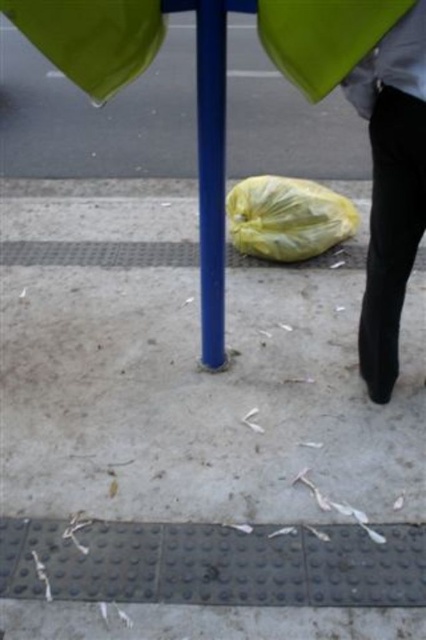
You are a visually impaired pedestrian using a white cane. You feel a yellow matte plastic bag at center and a blue glossy pole at center. Which object is closer to you?

The yellow matte plastic bag at center is closer to the viewer than the blue glossy pole at center.

You are a visually impaired pedestrian using a white cane. You feel a blue glossy pole at center and a yellow plastic bag at lower center on the sidewalk. Which object is narrower when touched?

The blue glossy pole at center is thinner than the yellow plastic bag at lower center, so the blue glossy pole at center feels narrower when touched.

You are standing at the tactile paving strip in the foreground. Where is the blue glossy pole at center located relative to your position?

The blue glossy pole at center is located at point 0.273 on the x axis and 0.495 on the y axis relative to your position.